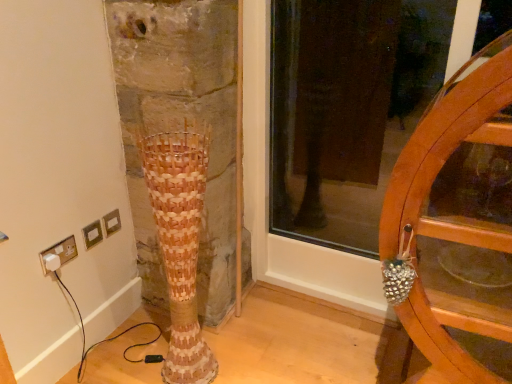
Where is `vacant point to the right of woven wood vase at center`? The height and width of the screenshot is (384, 512). vacant point to the right of woven wood vase at center is located at coordinates (247, 359).